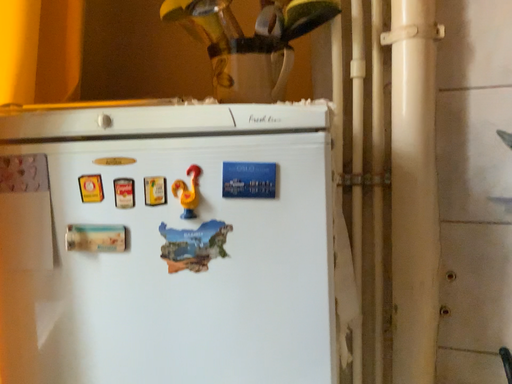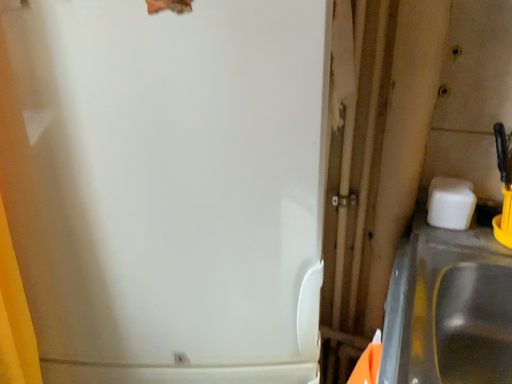
Question: How did the camera likely rotate when shooting the video?

Choices:
 (A) rotated upward
 (B) rotated downward

Answer: (B)